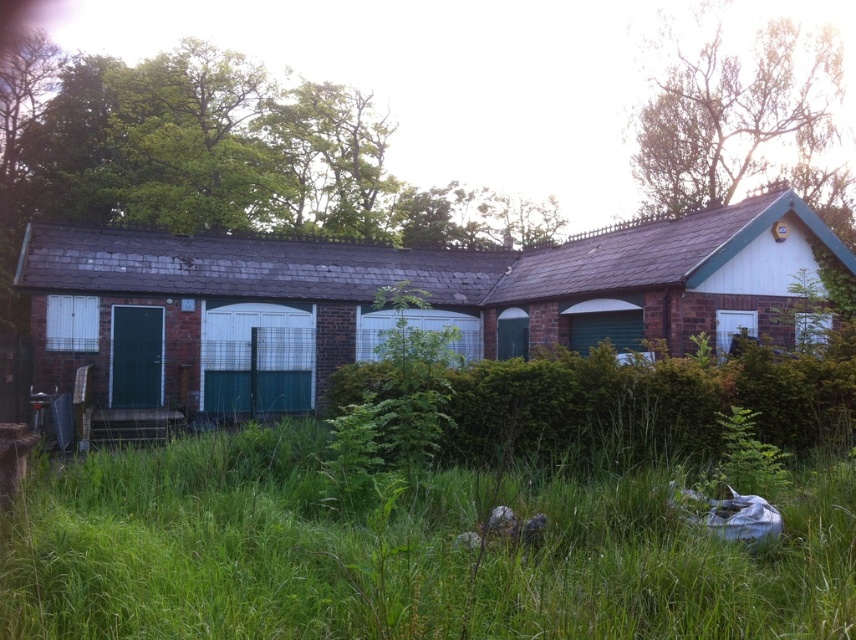
Is brown brick garage at center wider than brick wall garage at center?

Yes.

How much distance is there between brown brick garage at center and brick wall garage at center?

brown brick garage at center and brick wall garage at center are 1.29 meters apart.

Which is in front, point (583, 317) or point (714, 241)?

Point (714, 241)

Where is `brown brick garage at center`? This screenshot has height=640, width=856. brown brick garage at center is located at coordinates (389, 312).

Between green grass at lower center and brown brick garage at center, which one has less height?

With less height is green grass at lower center.

The height and width of the screenshot is (640, 856). What do you see at coordinates (401, 554) in the screenshot? I see `green grass at lower center` at bounding box center [401, 554].

The height and width of the screenshot is (640, 856). What do you see at coordinates (401, 554) in the screenshot? I see `green grass at lower center` at bounding box center [401, 554].

Locate an element on the screen. green grass at lower center is located at coordinates (401, 554).

At what (x,y) coordinates should I click in order to perform the action: click on green grass at lower center. Please return your answer as a coordinate pair (x, y). This screenshot has height=640, width=856. Looking at the image, I should click on (401, 554).

Which of these two, green grass at lower center or brick wall garage at center, stands taller?

brick wall garage at center is taller.

Measure the distance between green grass at lower center and camera.

A distance of 6.92 meters exists between green grass at lower center and camera.

Locate an element on the screen. This screenshot has width=856, height=640. green grass at lower center is located at coordinates (401, 554).